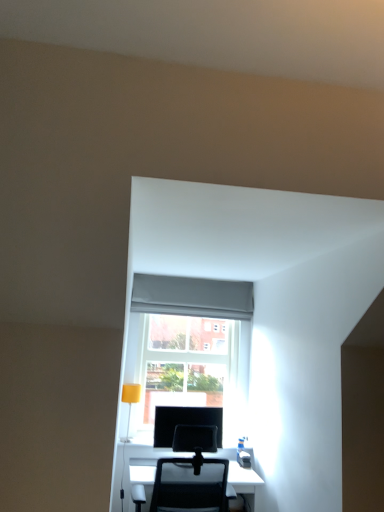
Question: From a real-world perspective, is yellow matte table lamp at lower left beneath matte black monitor at center?

Choices:
 (A) no
 (B) yes

Answer: (A)

Question: Is yellow matte table lamp at lower left at the right side of matte black monitor at center?

Choices:
 (A) no
 (B) yes

Answer: (A)

Question: Is yellow matte table lamp at lower left located outside matte black monitor at center?

Choices:
 (A) no
 (B) yes

Answer: (B)

Question: Is yellow matte table lamp at lower left thinner than matte black monitor at center?

Choices:
 (A) no
 (B) yes

Answer: (A)

Question: Is yellow matte table lamp at lower left positioned far away from matte black monitor at center?

Choices:
 (A) yes
 (B) no

Answer: (B)

Question: Is point (135, 480) closer or farther from the camera than point (139, 388)?

Choices:
 (A) closer
 (B) farther

Answer: (A)

Question: From the image's perspective, is black mesh chair at lower center above or below yellow matte table lamp at lower left?

Choices:
 (A) above
 (B) below

Answer: (B)

Question: Considering the positions of black mesh chair at lower center and yellow matte table lamp at lower left in the image, is black mesh chair at lower center wider or thinner than yellow matte table lamp at lower left?

Choices:
 (A) wide
 (B) thin

Answer: (A)

Question: Relative to yellow matte table lamp at lower left, is black mesh chair at lower center in front or behind?

Choices:
 (A) behind
 (B) front

Answer: (B)

Question: Would you say transparent glass door at center is to the left or to the right of yellow matte table lamp at lower left in the picture?

Choices:
 (A) right
 (B) left

Answer: (A)

Question: From a real-world perspective, is transparent glass door at center above or below yellow matte table lamp at lower left?

Choices:
 (A) above
 (B) below

Answer: (A)

Question: From their relative heights in the image, would you say transparent glass door at center is taller or shorter than yellow matte table lamp at lower left?

Choices:
 (A) short
 (B) tall

Answer: (B)

Question: Is transparent glass door at center wider or thinner than yellow matte table lamp at lower left?

Choices:
 (A) wide
 (B) thin

Answer: (A)

Question: Considering the positions of black mesh chair at lower center and transparent glass door at center in the image, is black mesh chair at lower center bigger or smaller than transparent glass door at center?

Choices:
 (A) small
 (B) big

Answer: (B)

Question: From the image's perspective, is black mesh chair at lower center above or below transparent glass door at center?

Choices:
 (A) above
 (B) below

Answer: (B)